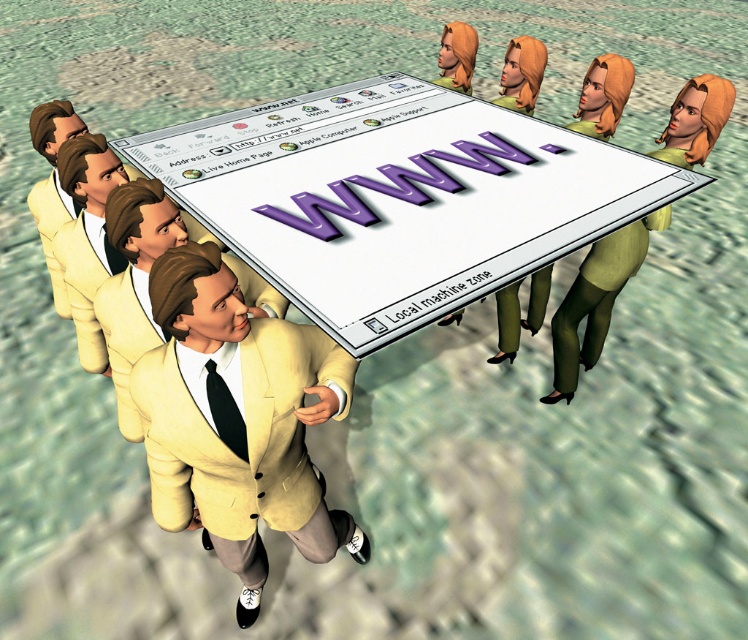
You are an observer standing in front of the image. You notice a point marked at coordinates (595, 300). Based on the scene description, what object is located at that point?

The point at coordinates (595, 300) indicates the green matte dress at right.

You are an observer looking at the group of people carrying the large screen. Which person is wearing clothing that is shorter in length between the matte yellow suit at center and the green matte dress at right?

The matte yellow suit at center is shorter than the green matte dress at right.

You are an observer standing in front of the image. You notice the green matte dress at right and the light yellow fabric business suit at lower left. Which object is placed higher in the image?

The green matte dress at right is positioned over the light yellow fabric business suit at lower left, so it is placed higher in the image.